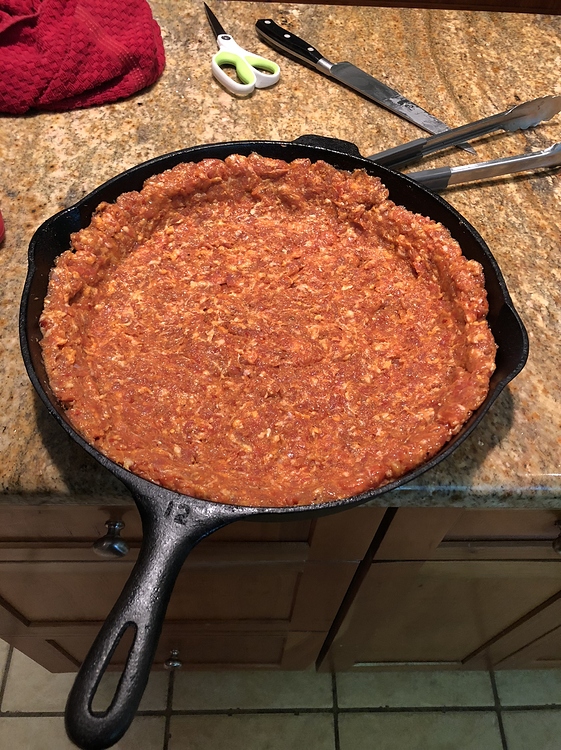
Locate an element on the screen. The image size is (561, 750). handle is located at coordinates (151, 580).